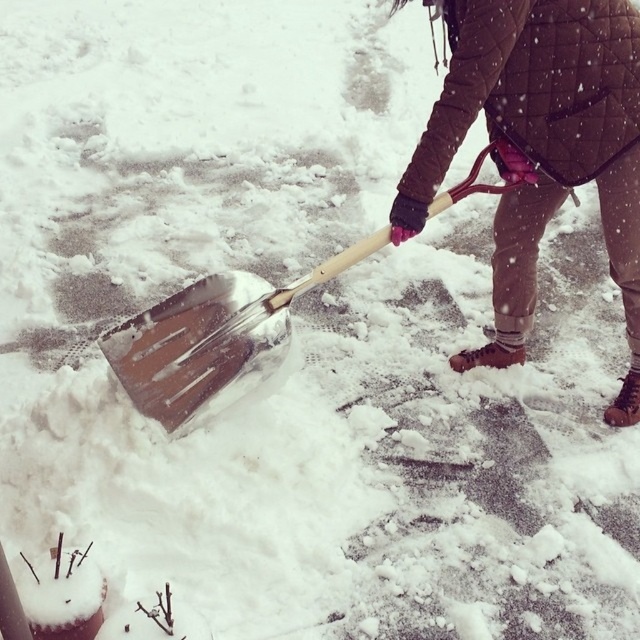
You are standing at the point marked by coordinates point (540, 148) in the snowy scene. Which object is directly in front of you?

The point (540, 148) marks the brown quilted jacket at upper center, so the brown quilted jacket at upper center is directly in front of you.

You are trying to locate the brown quilted jacket at upper center in the snowy scene. According to the coordinates provided, where exactly is it positioned?

The brown quilted jacket at upper center is located at point 0.233 on the x axis and 0.844 on the y axis.